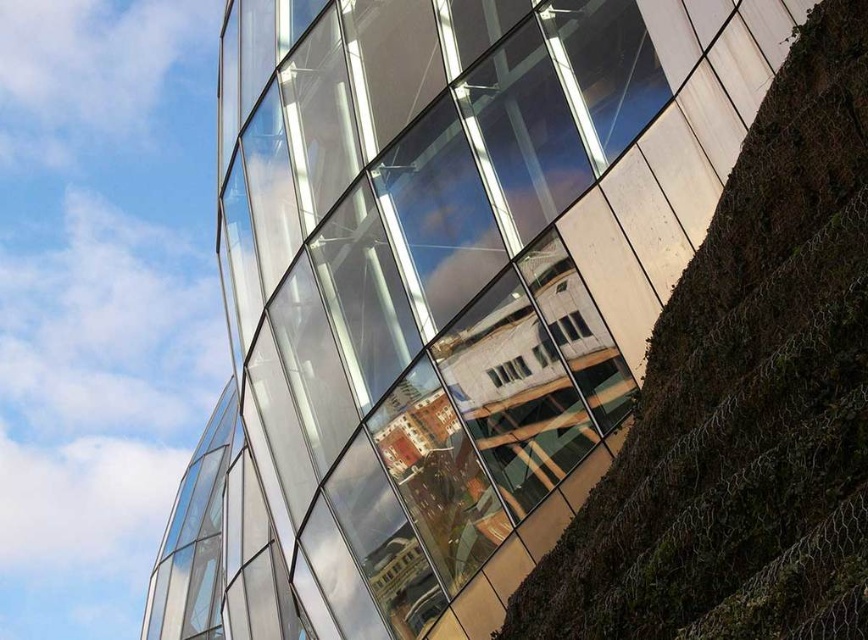
Question: Which object appears farthest from the camera in this image?

Choices:
 (A) transparent glass windows at center
 (B) green mossy hillside at right

Answer: (A)

Question: Is transparent glass windows at center to the left of green mossy hillside at right from the viewer's perspective?

Choices:
 (A) no
 (B) yes

Answer: (B)

Question: Which point appears farthest from the camera in this image?

Choices:
 (A) (620, 561)
 (B) (459, 449)

Answer: (B)

Question: Which point appears closest to the camera in this image?

Choices:
 (A) (701, 451)
 (B) (636, 314)

Answer: (A)

Question: Is transparent glass windows at center closer to camera compared to green mossy hillside at right?

Choices:
 (A) yes
 (B) no

Answer: (B)

Question: Is transparent glass windows at center bigger than green mossy hillside at right?

Choices:
 (A) yes
 (B) no

Answer: (A)